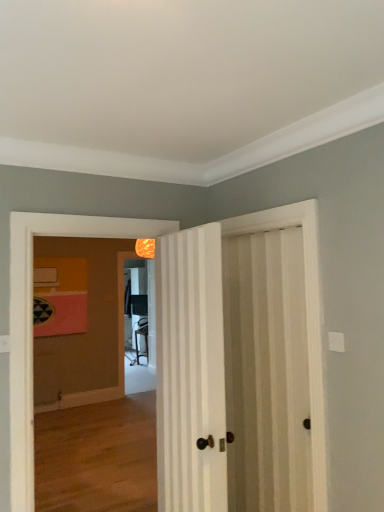
Question: Based on their positions, is white striped door at center, the second door in the right-to-left sequence, located to the left or right of wooden floor at center?

Choices:
 (A) right
 (B) left

Answer: (A)

Question: Would you say white striped door at center, marked as the 1th door in a left-to-right arrangement, is inside or outside wooden floor at center?

Choices:
 (A) outside
 (B) inside

Answer: (A)

Question: Estimate the real-world distances between objects in this image. Which object is closer to the matte black screen door at center?

Choices:
 (A) white striped door at center, the second door in the right-to-left sequence
 (B) wooden floor at center
 (C) white striped door at right, arranged as the first door when viewed from the right

Answer: (B)

Question: Estimate the real-world distances between objects in this image. Which object is farther from the white striped door at center, the second door in the right-to-left sequence?

Choices:
 (A) wooden floor at center
 (B) matte black screen door at center
 (C) white striped door at right, acting as the second door starting from the left

Answer: (B)